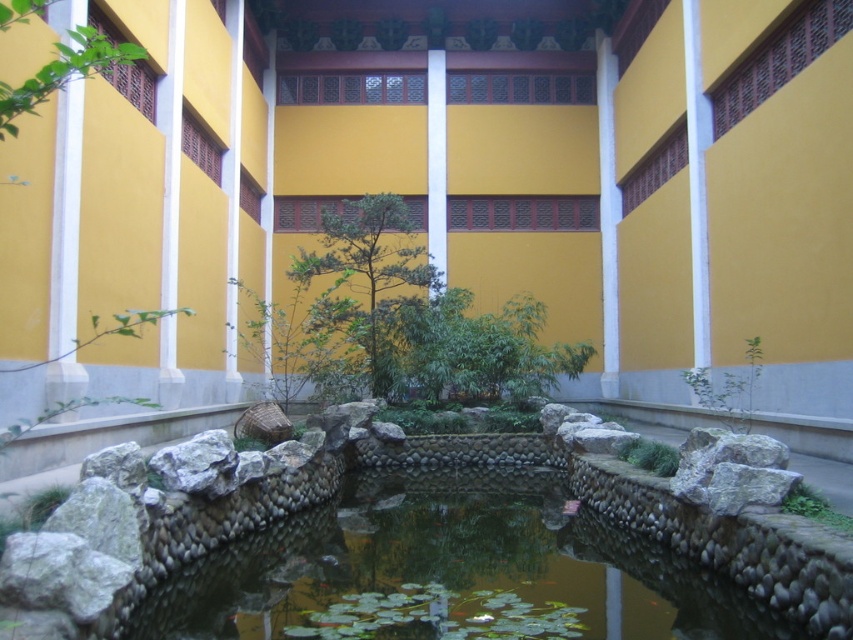
You are standing in the courtyard and want to walk from the green leafy tree at upper left to the clear stone water at center. Which direction should you head?

You should head to the right to reach the clear stone water at center from the green leafy tree at upper left because the clear stone water at center is located to the right of the green leafy tree at upper left.

You are standing in the courtyard and want to know the position of the clear stone water at center relative to the green matte tree at center. Which one is lower?

The clear stone water at center is below the green matte tree at center, so it is lower.

You are standing in the courtyard and want to walk from the entrance to the pond. There are two points marked in the scene, point (321, 637) and point (387, 362). Which point should you walk towards first to reach the pond?

Point (321, 637) is in front of point (387, 362), so you should walk towards point (321, 637) first to reach the pond.